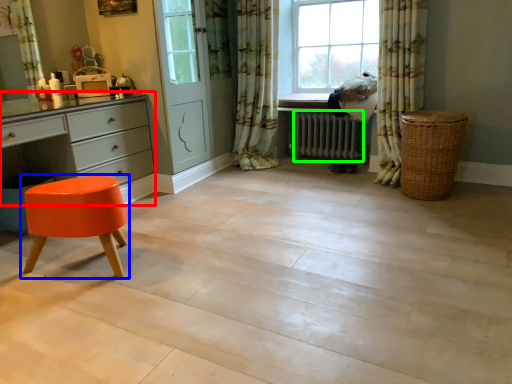
Question: Based on their relative distances, which object is nearer to chest of drawers (highlighted by a red box)? Choose from stool (highlighted by a blue box) and radiator (highlighted by a green box).

Choices:
 (A) stool
 (B) radiator

Answer: (A)